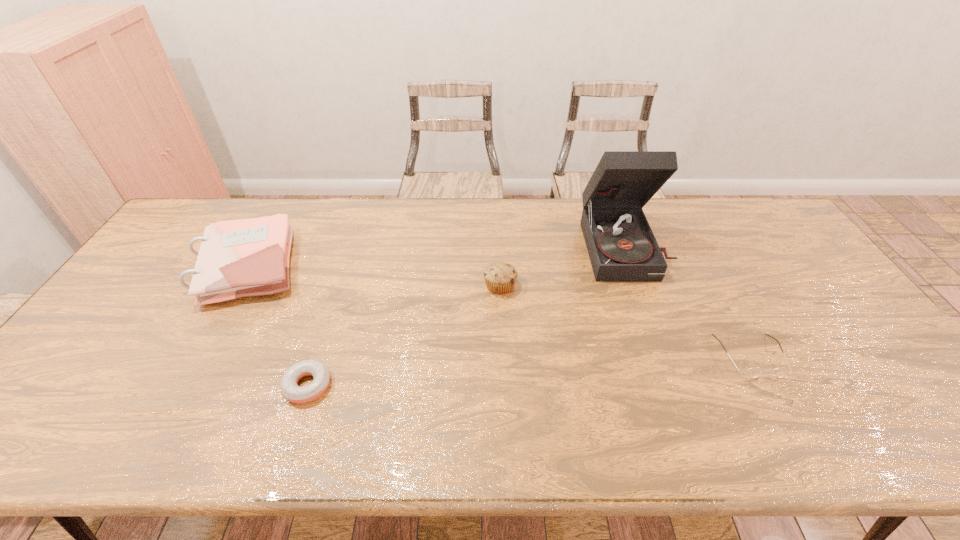
Locate an element on the screen. The image size is (960, 540). the tallest object is located at coordinates (621, 245).

Image resolution: width=960 pixels, height=540 pixels. Find the location of `phonograph_record`. phonograph_record is located at coordinates (621, 245).

Image resolution: width=960 pixels, height=540 pixels. I want to click on the leftmost object, so click(249, 257).

Locate an element on the screen. The height and width of the screenshot is (540, 960). muffin is located at coordinates (500, 277).

At what (x,y) coordinates should I click in order to perform the action: click on spectacles. Please return your answer as a coordinate pair (x, y). Looking at the image, I should click on (753, 372).

Locate an element on the screen. This screenshot has height=540, width=960. the shortest object is located at coordinates (290, 390).

Locate an element on the screen. the second object from left to right is located at coordinates (290, 390).

This screenshot has height=540, width=960. I want to click on free spot located on the front-facing side of the phonograph_record, so click(644, 299).

Where is `free point located 0.110m on the right of the leftmost object`? This screenshot has height=540, width=960. free point located 0.110m on the right of the leftmost object is located at coordinates (340, 266).

Find the location of `vacant space located 0.290m on the right of the muffin`. vacant space located 0.290m on the right of the muffin is located at coordinates (615, 285).